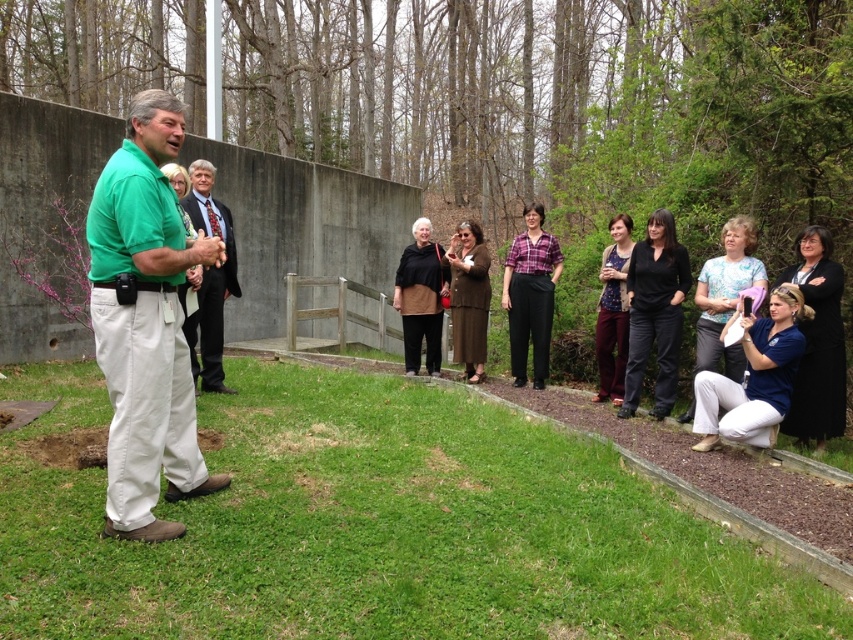
Question: Does black matte pants at center come behind plaid fabric shirt at center?

Choices:
 (A) yes
 (B) no

Answer: (B)

Question: Can you confirm if green grass at lower center is positioned to the left of matte black jacket at center?

Choices:
 (A) no
 (B) yes

Answer: (A)

Question: Estimate the real-world distances between objects in this image. Which object is closer to the matte black jacket at center?

Choices:
 (A) dark gray suit at center
 (B) blue cotton shirt at center

Answer: (A)

Question: Which point is closer to the camera?

Choices:
 (A) patterned fabric dress at center
 (B) green cotton shirt at left
 (C) matte black jacket at center
 (D) blue shirt at lower right

Answer: (B)

Question: Is green cotton shirt at left behind black matte pants at center?

Choices:
 (A) no
 (B) yes

Answer: (A)

Question: Based on their relative distances, which object is farther from the black matte pants at center?

Choices:
 (A) matte black jacket at center
 (B) blue shirt at lower right

Answer: (A)